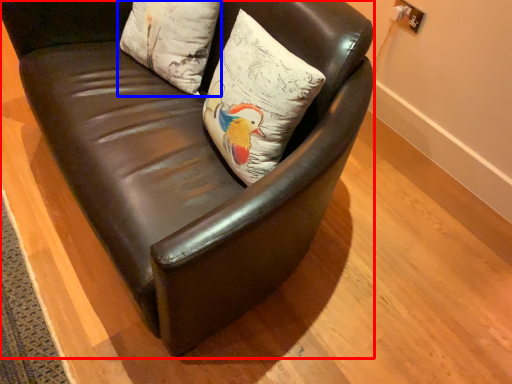
Question: Which object is further to the camera taking this photo, chair (highlighted by a red box) or pillow (highlighted by a blue box)?

Choices:
 (A) chair
 (B) pillow

Answer: (B)